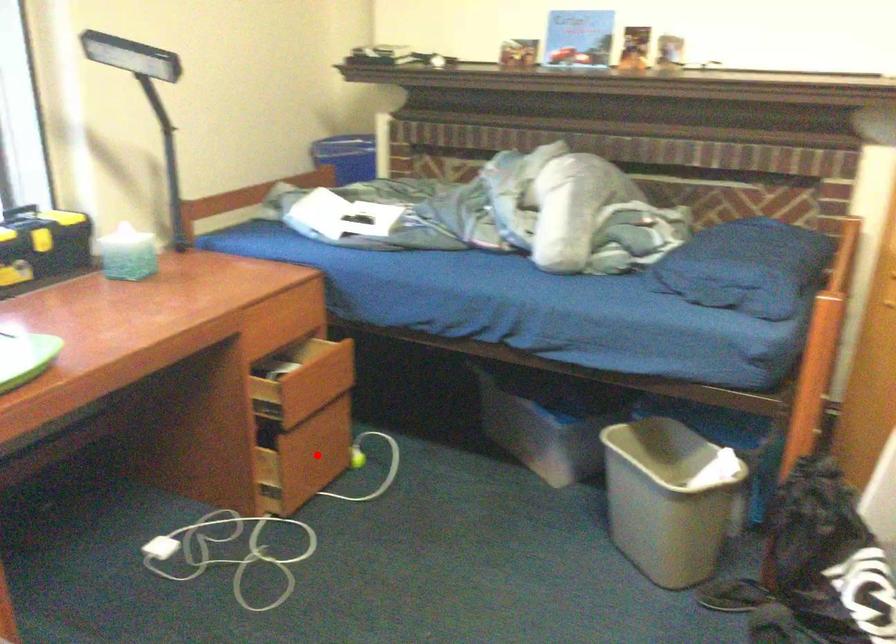
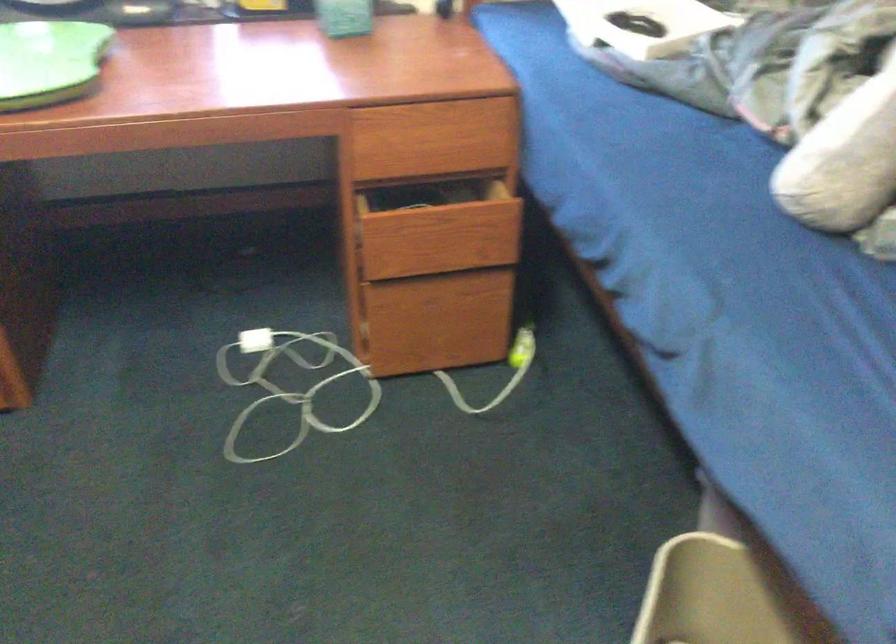
Find the pixel in the second image that matches the highlighted location in the first image.

(455, 321)